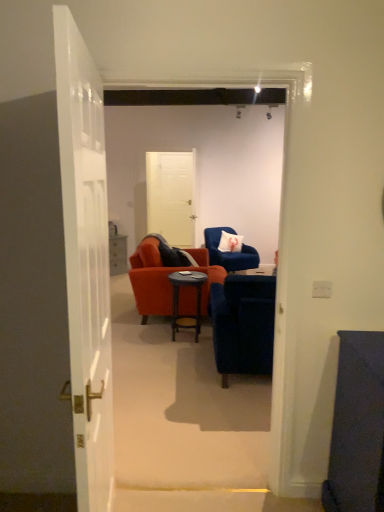
The width and height of the screenshot is (384, 512). I want to click on vacant space in front of dark wood side table at center, so click(x=180, y=349).